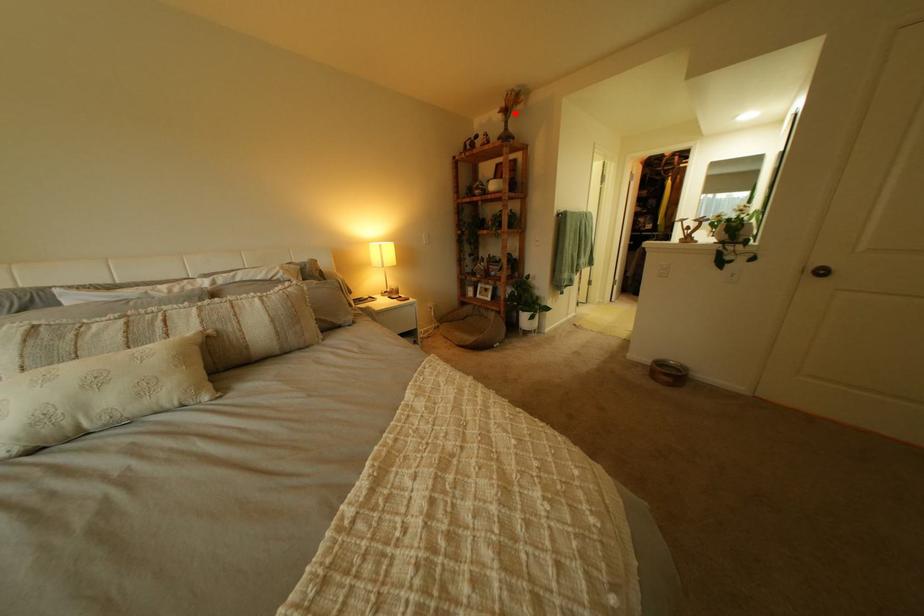
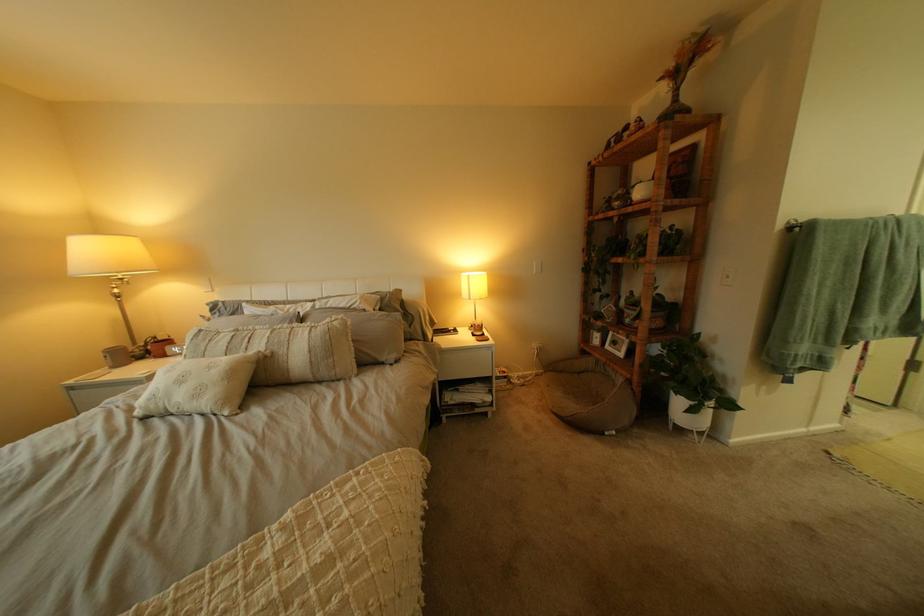
Locate, in the second image, the point that corresponds to the highlighted location in the first image.

(675, 81)